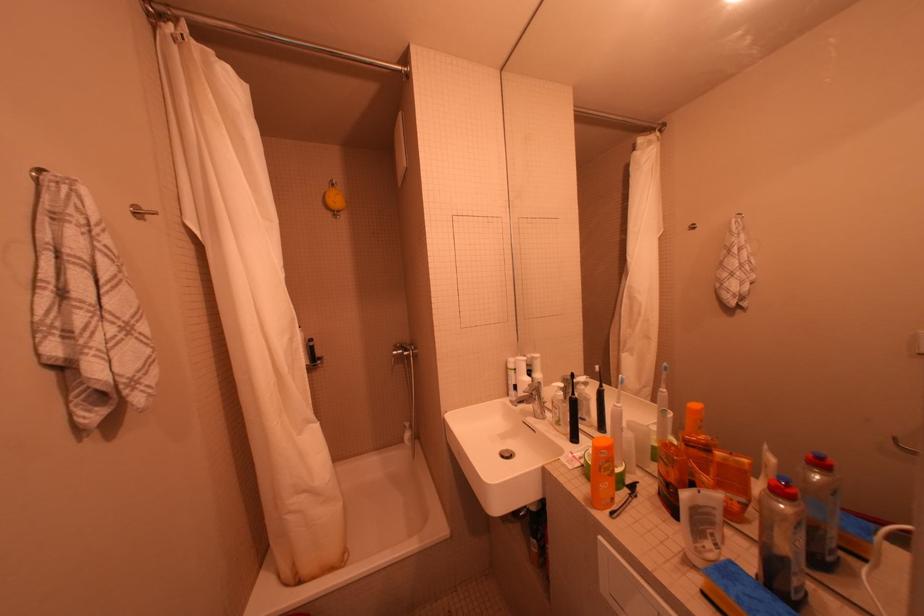
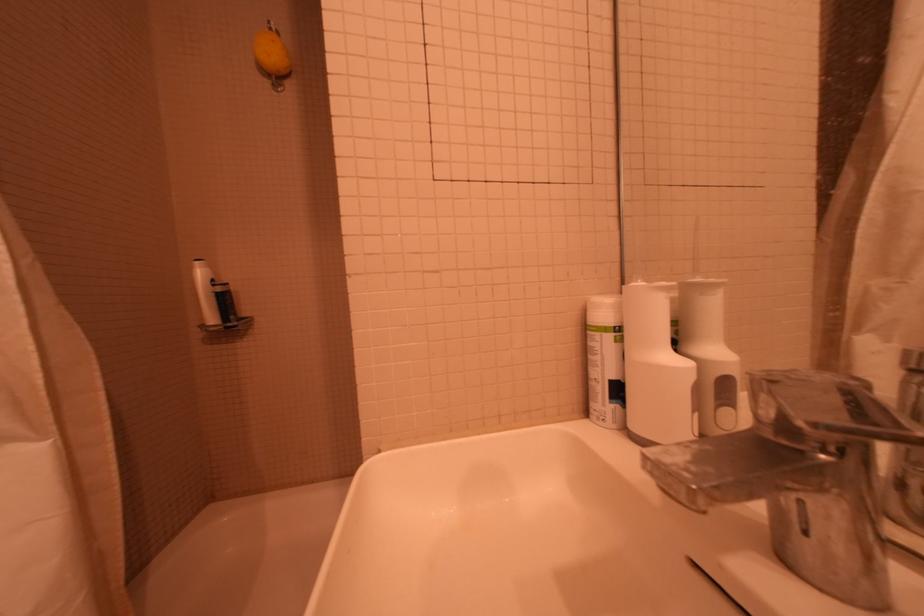
Find the pixel in the second image that matches (524,363) in the first image.

(627, 309)